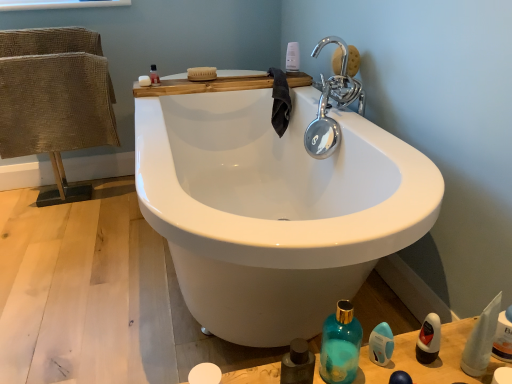
Image resolution: width=512 pixels, height=384 pixels. In order to click on vacant area that lies to the right of teal glass bottle at lower right in this screenshot , I will do `click(403, 360)`.